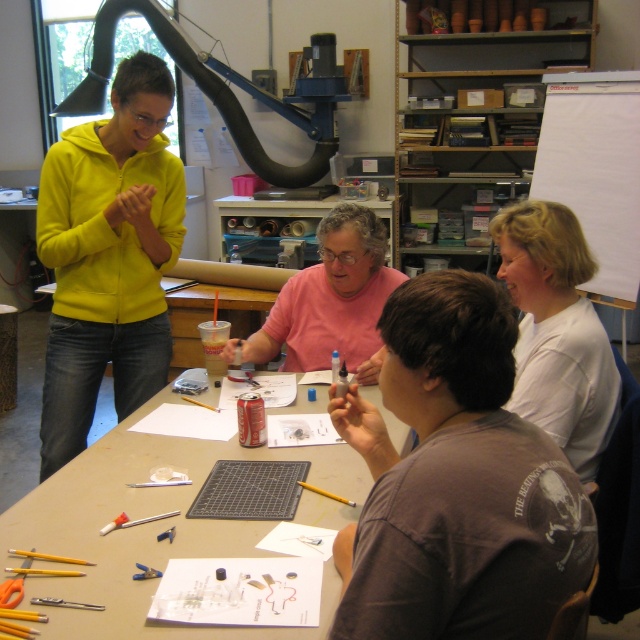
Does point (84, 513) lie behind point (525, 227)?

No, it is not.

Does matte gray cutting mat at center appear on the right side of white matte shirt at upper right?

Incorrect, matte gray cutting mat at center is not on the right side of white matte shirt at upper right.

Who is more distant from viewer, (216, 456) or (490, 228)?

Positioned behind is point (490, 228).

Locate an element on the screen. The image size is (640, 640). matte gray cutting mat at center is located at coordinates (160, 528).

Is dark brown cotton shirt at center below matte gray cutting mat at center?

No.

Consider the image. Is dark brown cotton shirt at center above matte gray cutting mat at center?

Yes.

Is point (445, 428) farther from viewer compared to point (177, 440)?

No, it is in front of (177, 440).

Identify the location of dark brown cotton shirt at center. (456, 481).

Does dark brown cotton shirt at center appear on the left side of white matte shirt at upper right?

Yes, dark brown cotton shirt at center is to the left of white matte shirt at upper right.

Who is more forward, (x=433, y=394) or (x=508, y=252)?

Point (x=433, y=394) is more forward.

Is point (460, 340) closer to camera compared to point (506, 273)?

Yes.

Where is `dark brown cotton shirt at center`? Image resolution: width=640 pixels, height=640 pixels. dark brown cotton shirt at center is located at coordinates (456, 481).